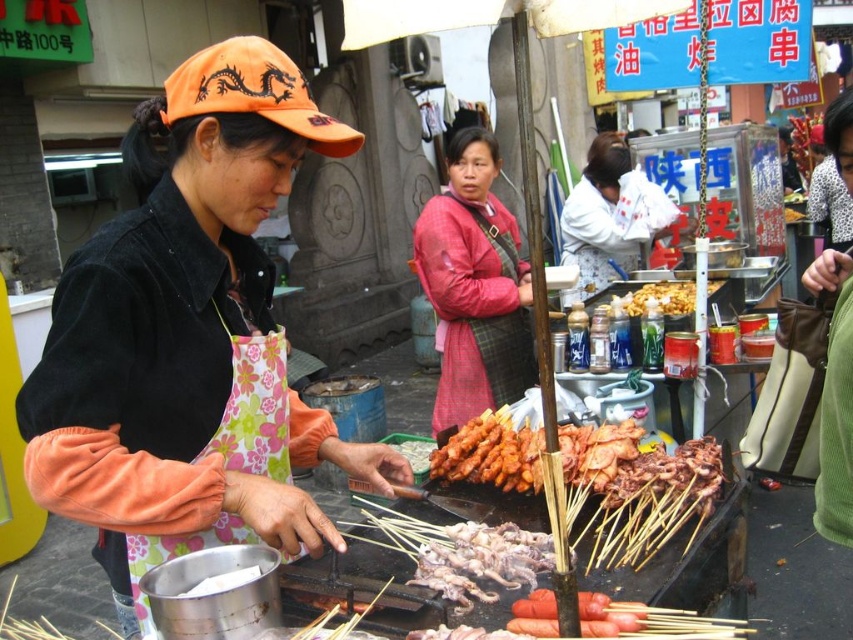
Which is behind, point (506, 355) or point (596, 273)?

The point (596, 273) is more distant.

Is point (459, 285) positioned behind point (589, 282)?

No, it is not.

You are a GUI agent. You are given a task and a screenshot of the screen. Output one action in this format:
    pyautogui.click(x=<x>, y=<y>)
    Task: Click on the pink fabric apron at center
    
    Given the screenshot: What is the action you would take?
    pyautogui.click(x=474, y=285)

Can you confirm if brownish matte skewers at center is positioned to the right of golden crispy fried chicken at center?

No, brownish matte skewers at center is not to the right of golden crispy fried chicken at center.

Consider the image. Is brownish matte skewers at center positioned at the back of golden crispy fried chicken at center?

No, brownish matte skewers at center is closer to the viewer.

Where is `brownish matte skewers at center`? This screenshot has height=640, width=853. brownish matte skewers at center is located at coordinates (480, 561).

Who is more distant from viewer, (566, 300) or (515, 561)?

Point (566, 300)

Is point (602, 221) less distant than point (473, 572)?

That is False.

Does point (614, 241) lie behind point (460, 596)?

Yes, point (614, 241) is behind point (460, 596).

Where is `white cotton shirt at center`? Image resolution: width=853 pixels, height=640 pixels. white cotton shirt at center is located at coordinates (601, 220).